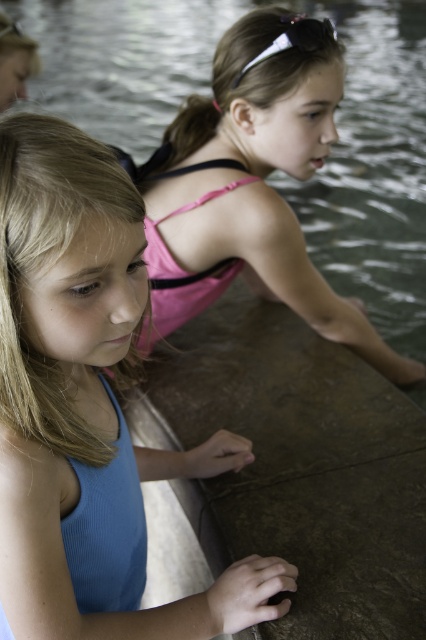
You are a lifeguard standing at the edge of the pool. You need to reach a floating object located at point (80,461). If your reach extends 80 centimeters, can you grab it without moving?

The point (80,461) is 81.51 centimeters away from the viewer, which is slightly beyond the lifeguard s 80 centimeter reach. Therefore, the lifeguard cannot grab it without moving.

You are a photographer trying to capture a clear photo of both the blue fabric swimsuit at left and the pink fabric swimsuit at upper center. Which swimsuit is closer to the camera?

The blue fabric swimsuit at left is closer to the camera because it is in front of the pink fabric swimsuit at upper center.